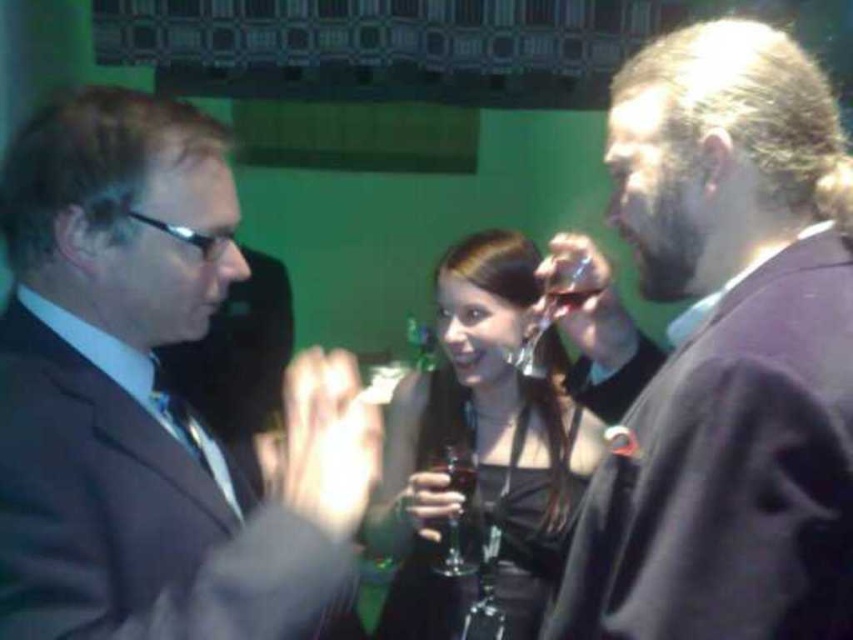
Question: Is matte black suit at left below clear glass at upper center?

Choices:
 (A) yes
 (B) no

Answer: (A)

Question: Which point is farther to the camera?

Choices:
 (A) (552, 321)
 (B) (564, 301)
 (C) (231, 612)

Answer: (A)

Question: Based on their relative distances, which object is nearer to the clear glass at upper center?

Choices:
 (A) clear glass wine glass at center
 (B) matte black suit at left
 (C) dark brown suit at right

Answer: (A)

Question: Estimate the real-world distances between objects in this image. Which object is farther from the transparent glass wine glass at center?

Choices:
 (A) clear glass wine glass at center
 (B) clear glass at upper center
 (C) satin black dress at center

Answer: (B)

Question: Can you confirm if matte black suit at left is positioned to the left of satin black dress at center?

Choices:
 (A) no
 (B) yes

Answer: (B)

Question: Is matte black suit at left thinner than dark brown suit at right?

Choices:
 (A) no
 (B) yes

Answer: (A)